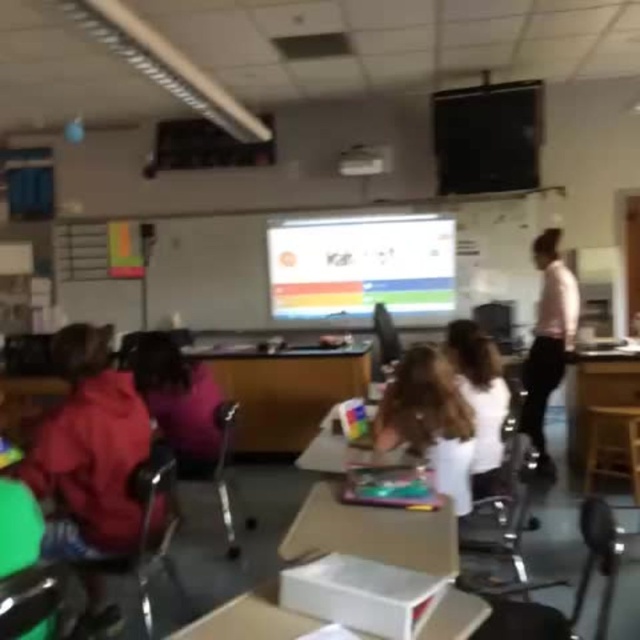
You are standing in the classroom and want to reach the point marked at coordinates (556, 314). If you can walk 15 feet in 10 seconds, how long will it take you to reach that point?

The point is 14.76 feet away, so it would take approximately 9.84 seconds to reach it since 14.76 divided by 1.5 feet per second equals 9.84 seconds.

You are a teacher standing at the front of the classroom. You need to hand out a worksheet to the student wearing the white fabric shirt at center and the student wearing the pink fabric shirt at right. If your arm can reach 2 meters, can you reach both students without moving from your position?

The distance between the white fabric shirt at center and the pink fabric shirt at right is 2.26 meters. Since your arm can only reach 2 meters, you cannot reach both students without moving from your position.